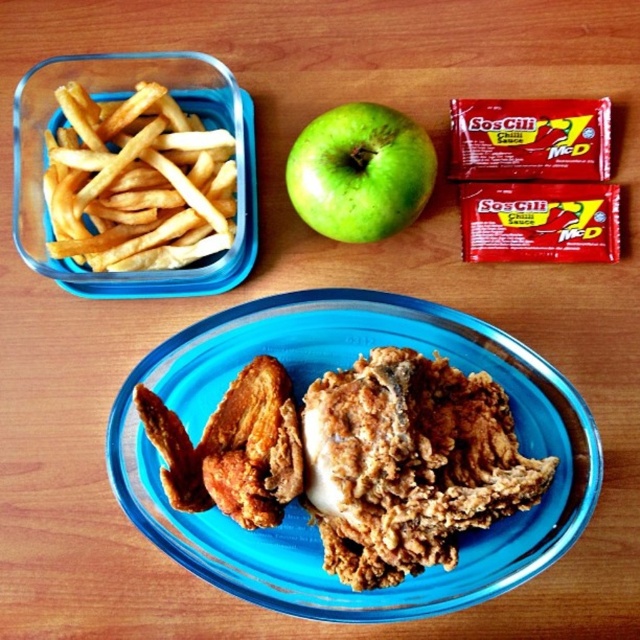
Question: Is yellow crispy french fries at left above green matte apple at center?

Choices:
 (A) yes
 (B) no

Answer: (B)

Question: Which object appears closest to the camera in this image?

Choices:
 (A) green matte apple at center
 (B) crispy fried chicken at center

Answer: (B)

Question: Which point appears closest to the camera in this image?

Choices:
 (A) (304, 552)
 (B) (179, 109)

Answer: (A)

Question: Can you confirm if crispy fried chicken at center is smaller than yellow crispy french fries at left?

Choices:
 (A) no
 (B) yes

Answer: (A)

Question: Which object appears farthest from the camera in this image?

Choices:
 (A) yellow crispy french fries at left
 (B) green matte apple at center
 (C) crispy fried chicken at center

Answer: (B)

Question: Is crispy fried chicken at center above green matte apple at center?

Choices:
 (A) no
 (B) yes

Answer: (A)